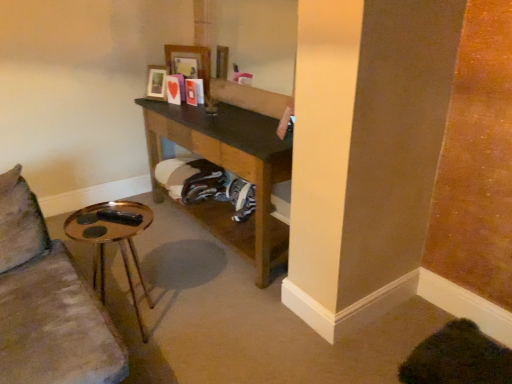
Question: From a real-world perspective, is brown wooden shelf at center on top of gold metallic side table at lower left?

Choices:
 (A) yes
 (B) no

Answer: (A)

Question: Is brown wooden shelf at center to the left of gold metallic side table at lower left from the viewer's perspective?

Choices:
 (A) no
 (B) yes

Answer: (A)

Question: Is brown wooden shelf at center outside gold metallic side table at lower left?

Choices:
 (A) yes
 (B) no

Answer: (A)

Question: From a real-world perspective, does brown wooden shelf at center sit lower than gold metallic side table at lower left?

Choices:
 (A) no
 (B) yes

Answer: (A)

Question: From the image's perspective, is brown wooden shelf at center under gold metallic side table at lower left?

Choices:
 (A) no
 (B) yes

Answer: (A)

Question: Is brown wooden shelf at center far away from gold metallic side table at lower left?

Choices:
 (A) no
 (B) yes

Answer: (A)

Question: Is wooden picture frame at upper center, acting as the second picture frame starting from the left, positioned with its back to gold metallic side table at lower left?

Choices:
 (A) yes
 (B) no

Answer: (B)

Question: From a real-world perspective, is wooden picture frame at upper center, acting as the second picture frame starting from the left, located beneath gold metallic side table at lower left?

Choices:
 (A) no
 (B) yes

Answer: (A)

Question: Considering the relative sizes of wooden picture frame at upper center, acting as the second picture frame starting from the left, and gold metallic side table at lower left in the image provided, is wooden picture frame at upper center, acting as the second picture frame starting from the left, smaller than gold metallic side table at lower left?

Choices:
 (A) no
 (B) yes

Answer: (B)

Question: Is wooden picture frame at upper center, acting as the second picture frame starting from the left, touching gold metallic side table at lower left?

Choices:
 (A) no
 (B) yes

Answer: (A)

Question: Can you confirm if wooden picture frame at upper center, acting as the second picture frame starting from the left, is wider than gold metallic side table at lower left?

Choices:
 (A) no
 (B) yes

Answer: (A)

Question: Is the position of wooden picture frame at upper center, placed as the first picture frame when sorted from right to left, less distant than that of gold metallic side table at lower left?

Choices:
 (A) no
 (B) yes

Answer: (A)

Question: Does wooden photo frame at upper center, the 2th picture frame from the right, come in front of wooden picture frame at upper center, placed as the first picture frame when sorted from right to left?

Choices:
 (A) no
 (B) yes

Answer: (A)